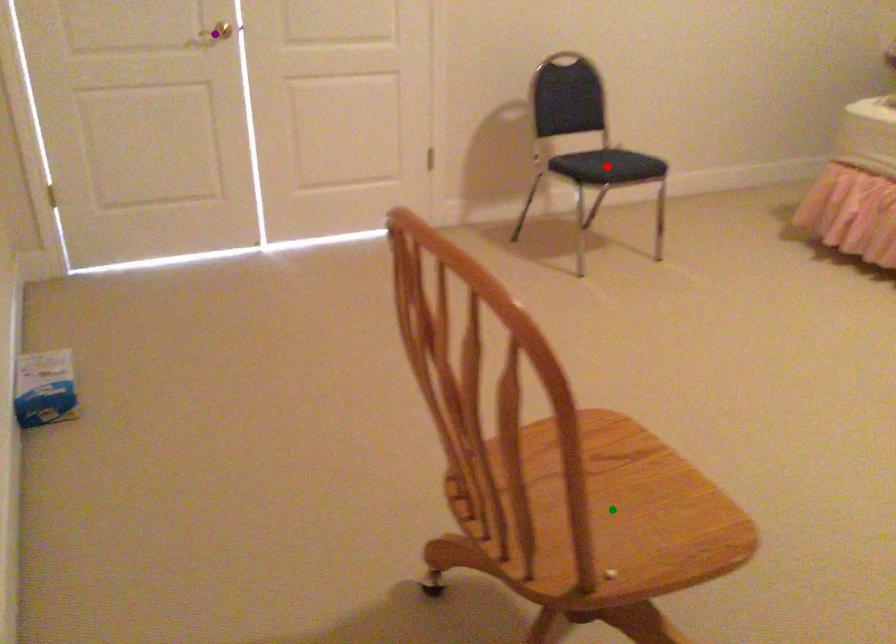
Order these from nearest to farthest:
green point
red point
purple point

green point
purple point
red point